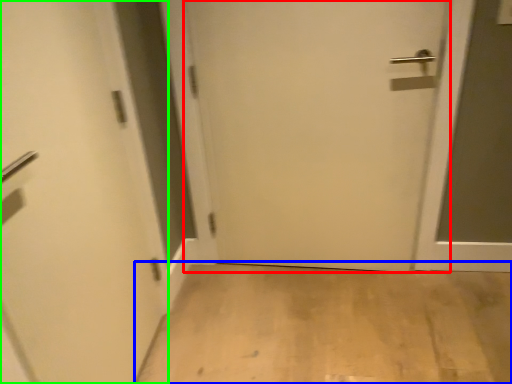
Question: Which object is the closest to the door (highlighted by a red box)? Choose among these: corridor (highlighted by a blue box) or door (highlighted by a green box).

Choices:
 (A) corridor
 (B) door

Answer: (A)